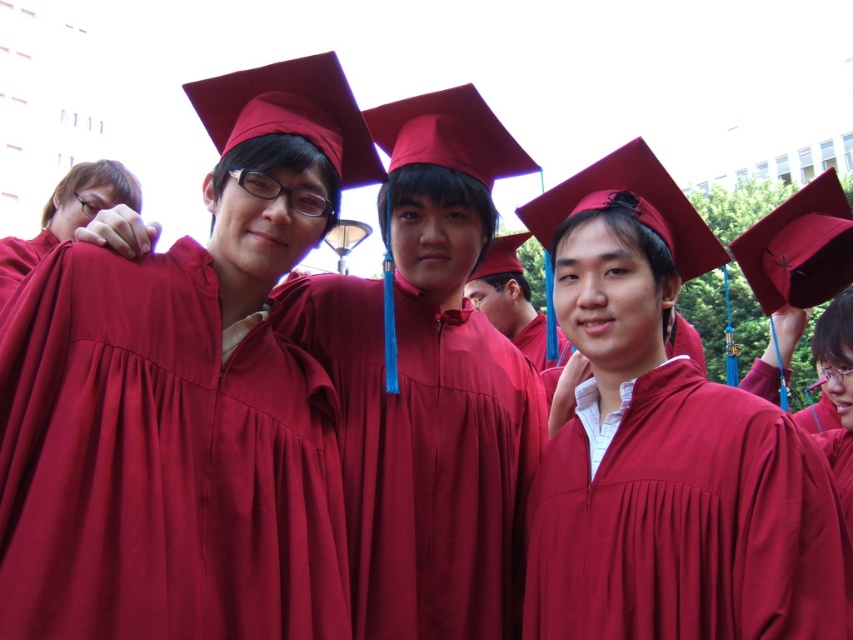
You are a photographer trying to capture a group photo of the graduates. You notice the maroon satin gown at center and the matte red graduation gown at left. Which gown should you focus on to ensure it fits entirely within the camera frame if the frame can only accommodate the width of the narrower gown?

The matte red graduation gown at left should be focused on because the maroon satin gown at center is wider than the matte red graduation gown at left, so focusing on the narrower gown ensures it fits within the frame.